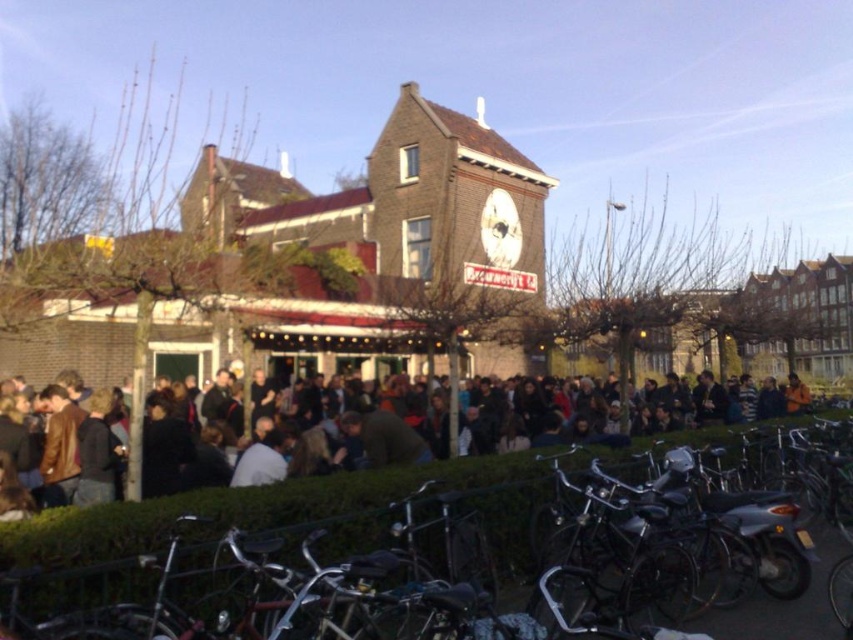
You are a delivery person who needs to pass through the crowd behind the hedge. You have a cart that is 1.2 meters wide. The shiny metallic bicycle at center and the dark brown leather jacket at center are in your path. Can your cart fit between them?

The shiny metallic bicycle at center has a lesser width compared to dark brown leather jacket at center. Since the bicycle is narrower than the jacket, the space between them might be sufficient for your 1.2 meter wide cart. However, without knowing the exact distance between them, it is uncertain. The answer should be based on the given information that the bicycle is narrower, so if the jacket is wider, the space between them could be wider than the bicycle. But the problem states that the bicycle is less

You are standing at the point labeled point (572, 440) in the town square. You want to walk to the point labeled point (141, 588). Which direction should you head?

You should head forward because point (141, 588) is in front of point (572, 440).